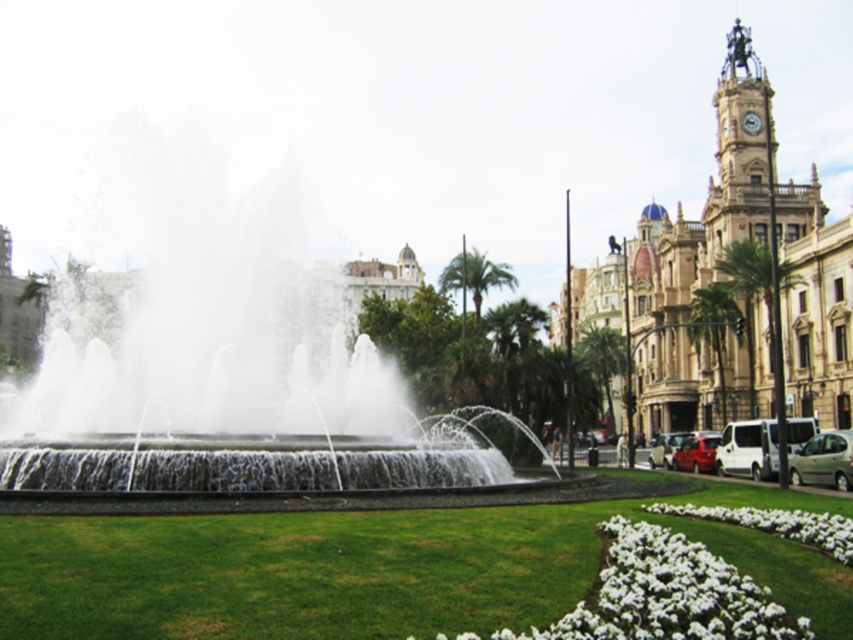
What are the coordinates of the clear water fountain at center?

The clear water fountain at center is located at coordinates point (x=231, y=385).

You are standing at the fountain and want to walk to the point marked as point (693, 513). There is an obstacle at point (180, 461). Will you be able to see the obstacle from your current position?

Point (180, 461) is behind point (693, 513), so if you are standing at the fountain facing towards point (693, 513), you would not be able to see the obstacle at point (180, 461) because it is located behind your target point.

You are a landscape architect designing a new public space. You need to place a statue that is 3 meters tall. Given the clear water fountain at center and the white matte flowers at lower right, which object would be more suitable to position the statue next to, considering their sizes?

The clear water fountain at center is larger in size than the white matte flowers at lower right, so positioning the statue next to the clear water fountain at center would be more suitable as it can accommodate the statue better due to its larger size.